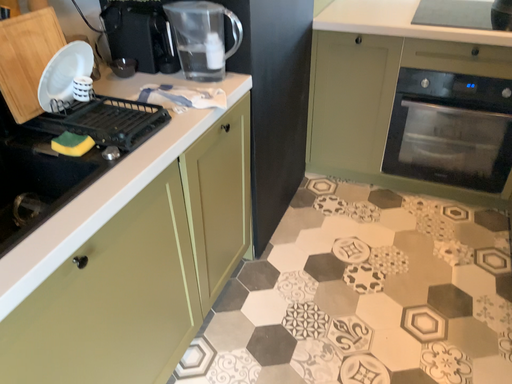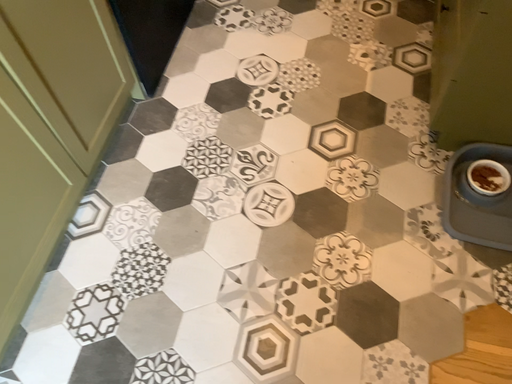
Question: How did the camera likely rotate when shooting the video?

Choices:
 (A) rotated downward
 (B) rotated upward

Answer: (A)